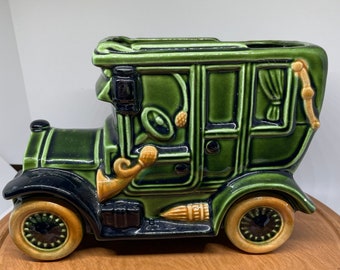
The width and height of the screenshot is (340, 270). I want to click on window, so click(x=270, y=100), click(x=231, y=110), click(x=171, y=118).